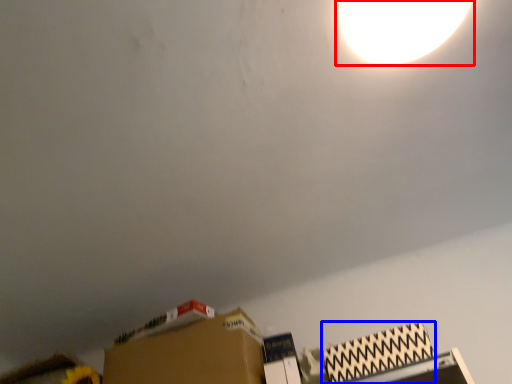
Question: Which of the following is the farthest to the observer, lamp (highlighted by a red box) or cardboard box (highlighted by a blue box)?

Choices:
 (A) lamp
 (B) cardboard box

Answer: (B)